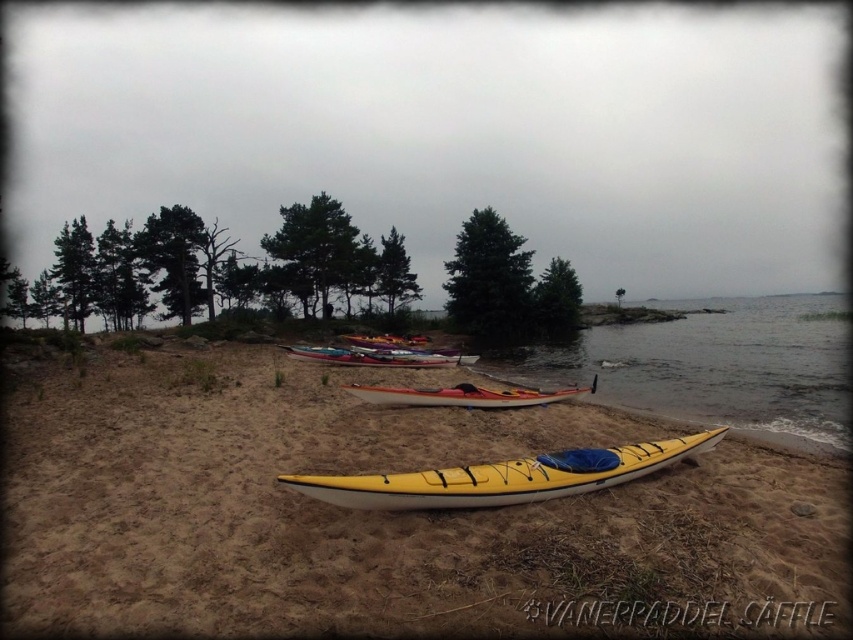
You are standing on the sandy beach and see the yellow plastic kayak at lower center and the yellow matte kayak at center. Which kayak is positioned to the right of the other?

The yellow plastic kayak at lower center is to the right of the yellow matte kayak at center.

You are standing at the lakeside and want to locate two specific points marked in the image. The first point is at coordinates point (672, 330) and the second at point (329, 480). Which point is closer to your current position?

Point (672, 330) is further to the camera than point (329, 480), so the closer point to your current position is point (329, 480).

You are planning to rent a kayak for a short trip on the lake. You see the yellow plastic kayak at lower center and the matte red kayak at center. Which kayak would you choose if you want a larger one for more stability?

The yellow plastic kayak at lower center is bigger than the matte red kayak at center, so it would be more stable for your short trip.